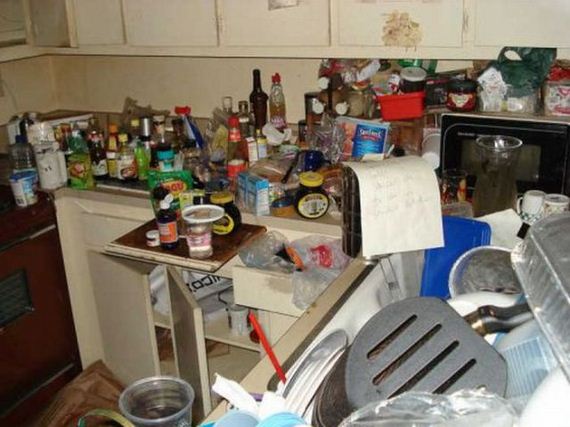
Find the location of a particular element. bottom oven drawer is located at coordinates (31, 402).